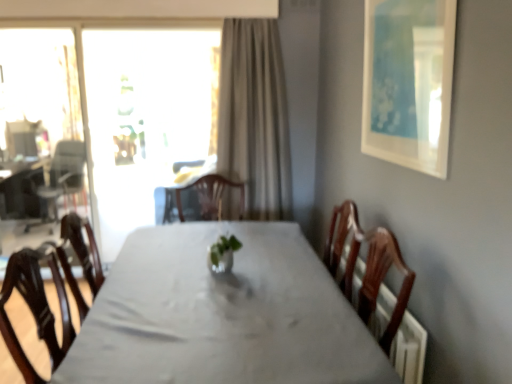
Question: Considering the positions of white matte picture frame at upper right and matte black armchair at left in the image, is white matte picture frame at upper right bigger or smaller than matte black armchair at left?

Choices:
 (A) small
 (B) big

Answer: (A)

Question: Is white matte picture frame at upper right spatially inside matte black armchair at left, or outside of it?

Choices:
 (A) inside
 (B) outside

Answer: (B)

Question: Which object is positioned farthest from the white glossy table at center?

Choices:
 (A) matte black armchair at left
 (B) white matte picture frame at upper right
 (C) beige fabric curtain at center
 (D) transparent glass screen door at left
 (E) transparent glass window at upper left

Answer: (A)

Question: Which is nearer to the matte black armchair at left?

Choices:
 (A) transparent glass screen door at left
 (B) transparent glass window at upper left
 (C) white matte picture frame at upper right
 (D) beige fabric curtain at center
 (E) white glossy table at center

Answer: (A)